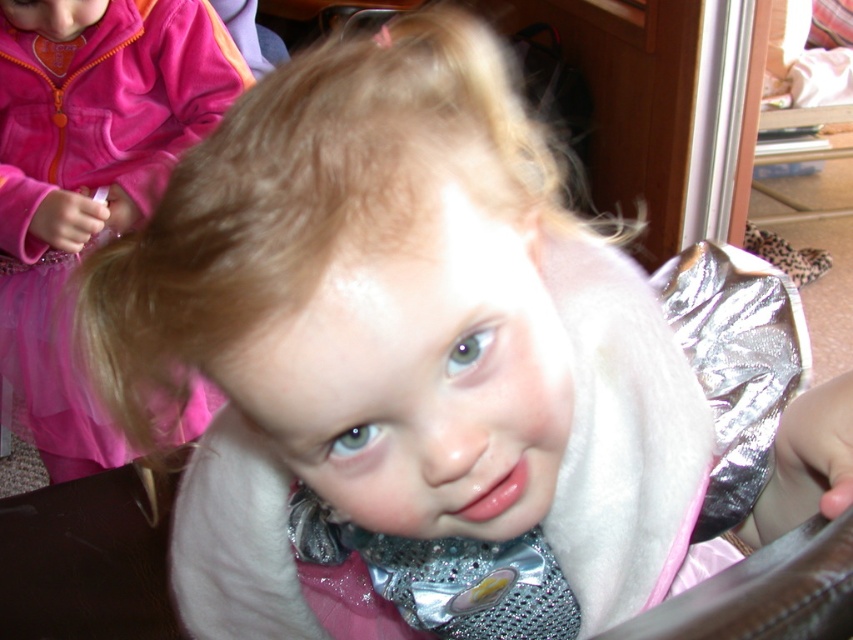
Does matte pink dress at upper left have a greater height compared to silver reflective foil at center?

Yes, matte pink dress at upper left is taller than silver reflective foil at center.

Is point (85, 177) more distant than point (733, 259)?

Yes, it is behind point (733, 259).

Describe the element at coordinates (88, 177) in the screenshot. I see `matte pink dress at upper left` at that location.

Identify the location of matte pink dress at upper left. The width and height of the screenshot is (853, 640). (88, 177).